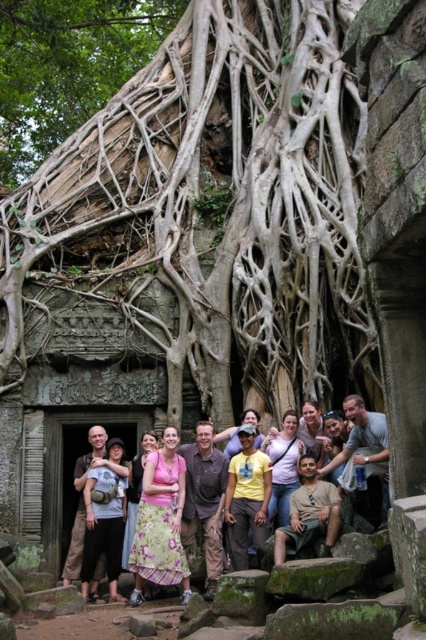
Question: Which object is the closest to the floral skirt at center?

Choices:
 (A) light pink fabric dress at center
 (B) pink floral dress at center
 (C) white textured roots at center

Answer: (B)

Question: Which point is closer to the camera?

Choices:
 (A) brown textured roots at upper center
 (B) light pink fabric dress at center

Answer: (B)

Question: Which of these objects is positioned farthest from the yellow t-shirt at center?

Choices:
 (A) white textured roots at center
 (B) pink floral dress at center
 (C) floral skirt at center

Answer: (A)

Question: Is pink fabric dress at center above yellow t-shirt at center?

Choices:
 (A) yes
 (B) no

Answer: (B)

Question: Is brown textured roots at upper center wider than light pink fabric dress at center?

Choices:
 (A) yes
 (B) no

Answer: (A)

Question: Can you confirm if floral skirt at center is thinner than yellow t-shirt at center?

Choices:
 (A) yes
 (B) no

Answer: (B)